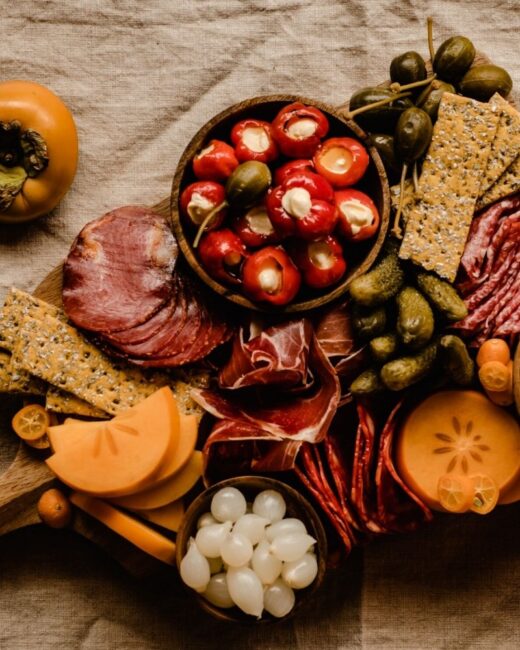
This screenshot has height=650, width=520. I want to click on wooden bowls, so click(246, 110), click(278, 483).